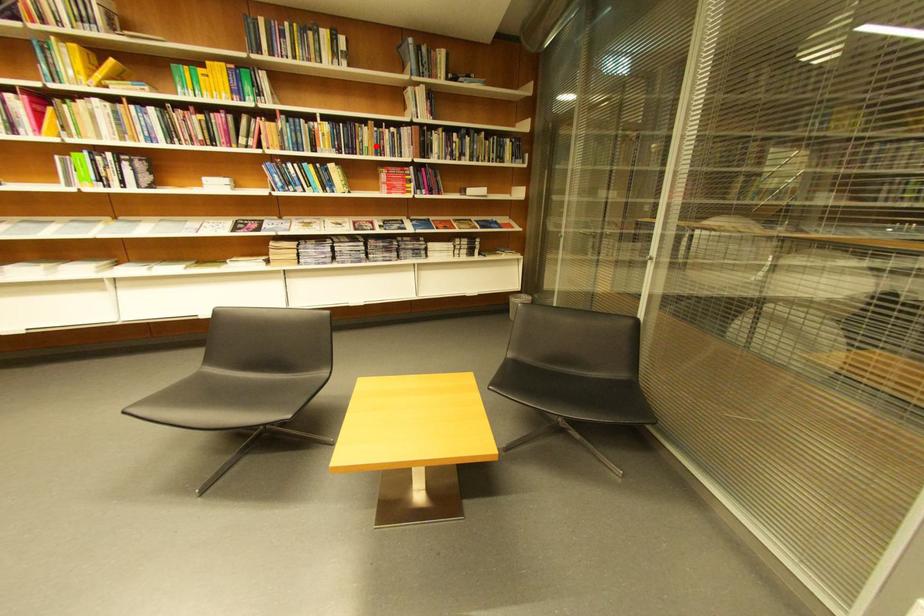
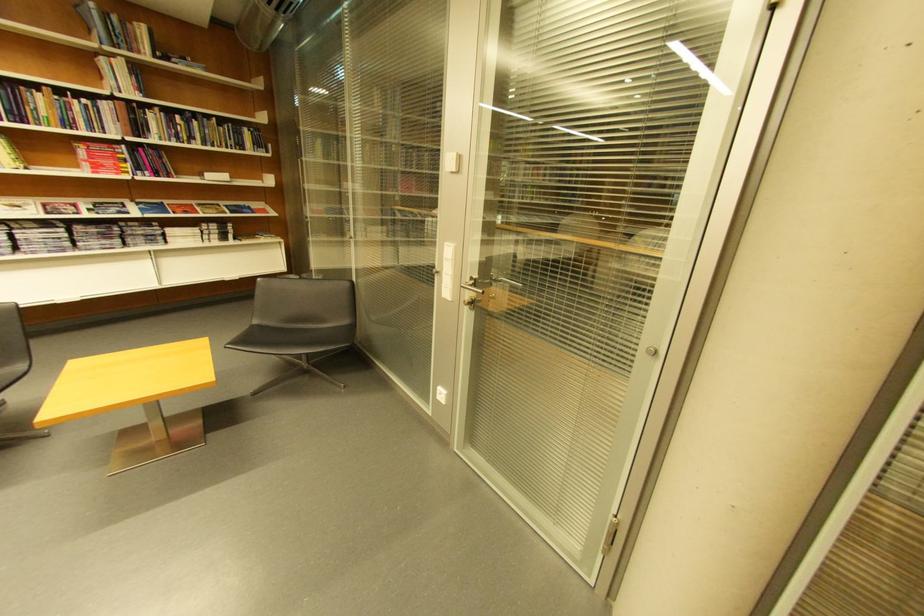
Question: I am providing you with two images of the same scene from different viewpoints. Given a red point in image1, look at the same physical point in image2. Is it:

Choices:
 (A) Closer to the viewpoint
 (B) Farther from the viewpoint

Answer: (B)